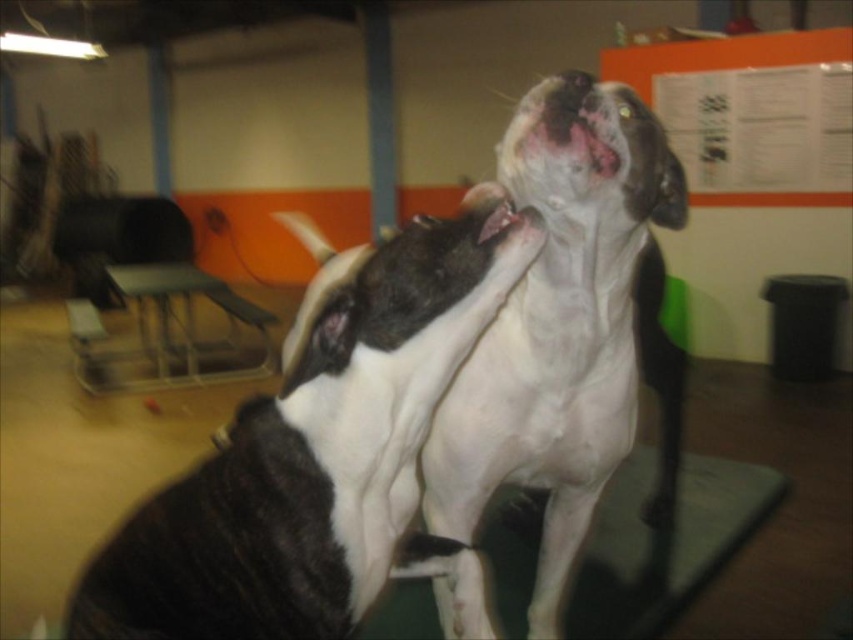
Is point (564, 304) positioned behind point (503, 198)?

Yes.

Is point (518, 365) positioned after point (491, 227)?

Yes, it is.

Where is `white smooth dog at center`? Image resolution: width=853 pixels, height=640 pixels. white smooth dog at center is located at coordinates (566, 330).

Who is positioned more to the left, black and white fur dog at center or white smooth dog at center?

From the viewer's perspective, black and white fur dog at center appears more on the left side.

Consider the image. Can you confirm if black and white fur dog at center is positioned to the right of white smooth dog at center?

Incorrect, black and white fur dog at center is not on the right side of white smooth dog at center.

Measure the distance between point (376, 300) and camera.

Point (376, 300) is 38.42 inches from camera.

Where is `black and white fur dog at center`? This screenshot has width=853, height=640. black and white fur dog at center is located at coordinates (318, 464).

Who is positioned more to the left, black and white fur dog at center or white glossy mouth at upper center?

black and white fur dog at center is more to the left.

Is black and white fur dog at center smaller than white glossy mouth at upper center?

Incorrect, black and white fur dog at center is not smaller in size than white glossy mouth at upper center.

Find the location of a particular element. This screenshot has height=640, width=853. black and white fur dog at center is located at coordinates click(318, 464).

Find the location of `black and white fur dog at center`. black and white fur dog at center is located at coordinates (318, 464).